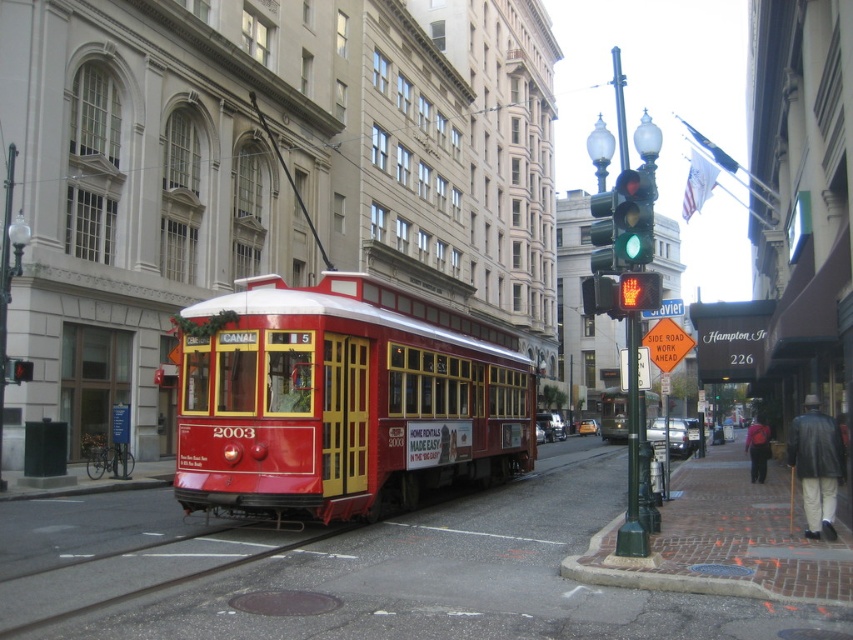
You are a delivery person with a box that is 60 centimeters long. You need to place the box between the green glass traffic light at upper center and the red glass pedestrian signal at center. Can the box fit in the space between them?

The distance between the green glass traffic light at upper center and the red glass pedestrian signal at center is 58.54 centimeters. Since the box is 60 centimeters long, it cannot fit in the space between them.

You are a tourist in New Orleans and want to cross the street safely. You see a green glass traffic light at upper center and a red glass pedestrian signal at center. Which signal should you pay attention to for pedestrian crossing instructions?

You should pay attention to the red glass pedestrian signal at center because it is specifically designed for pedestrian crossing instructions, and it is larger than the green glass traffic light at upper center, making it more visible for pedestrians.

You are a delivery driver who needs to turn left onto the street where the green glass traffic light at upper center is located. The traffic light is at coordinates 0.339, 0.743. Is the traffic light positioned to your left or right side as you approach the intersection?

The green glass traffic light at upper center is located at coordinates (633, 216). Since the x coordinate is 0.339, which is less than 0.5, it is positioned to your left side as you approach the intersection.